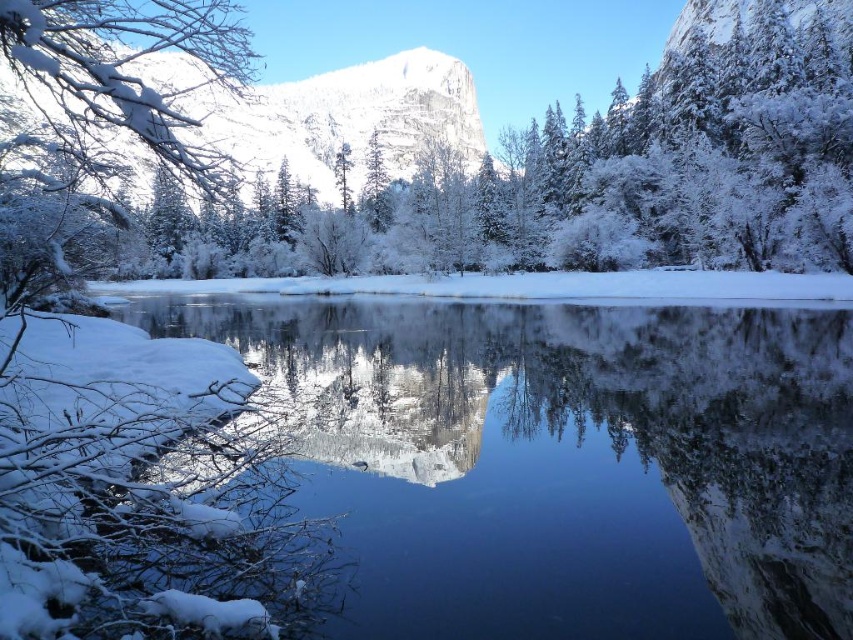
Question: Can you confirm if white snow-covered branch at left is smaller than green matte tree at center?

Choices:
 (A) yes
 (B) no

Answer: (B)

Question: Which point is farther to the camera?

Choices:
 (A) white snow-covered branch at left
 (B) white snow-covered mountain at center
 (C) clear glass water at center
 (D) green matte tree at center

Answer: (D)

Question: Does clear glass water at center have a larger size compared to green matte tree at center?

Choices:
 (A) yes
 (B) no

Answer: (B)

Question: Which object is closer to the camera taking this photo?

Choices:
 (A) clear glass water at center
 (B) white snow-covered mountain at center
 (C) white snow-covered branch at left
 (D) green matte tree at center

Answer: (A)

Question: Can you confirm if white snow-covered branch at left is positioned to the left of green matte tree at center?

Choices:
 (A) no
 (B) yes

Answer: (B)

Question: Among these objects, which one is farthest from the camera?

Choices:
 (A) white snow-covered mountain at center
 (B) green matte tree at center
 (C) clear glass water at center
 (D) white snow-covered branch at left

Answer: (B)